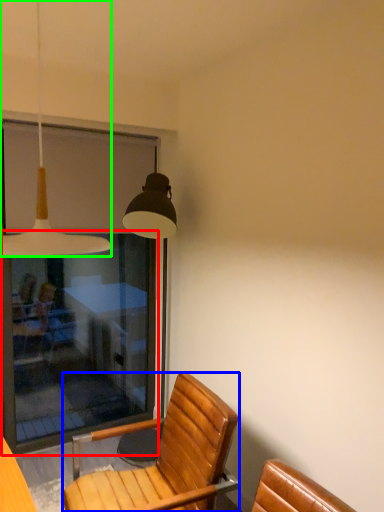
Question: Estimate the real-world distances between objects in this image. Which object is closer to screen door (highlighted by a red box), chair (highlighted by a blue box) or lamp (highlighted by a green box)?

Choices:
 (A) chair
 (B) lamp

Answer: (A)